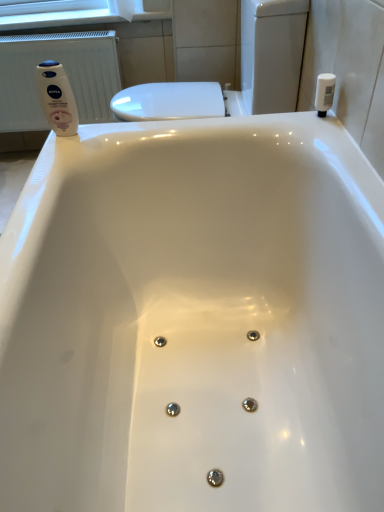
This screenshot has width=384, height=512. What do you see at coordinates (324, 93) in the screenshot? I see `white plastic bottle at upper right, which appears as the 2th toiletry when viewed from the left` at bounding box center [324, 93].

Identify the location of white matte toilet paper at upper left. The image size is (384, 512). (126, 8).

Identify the location of toiletry that is the 1st one when counting downward from the white matte toilet paper at upper left (from the image's perspective). (324, 93).

Between point (122, 14) and point (332, 86), which one is positioned behind?

Positioned behind is point (122, 14).

Considering the relative sizes of white matte toilet paper at upper left and white plastic bottle at upper right, marked as the first toiletry in a right-to-left arrangement, in the image provided, is white matte toilet paper at upper left bigger than white plastic bottle at upper right, marked as the first toiletry in a right-to-left arrangement,?

Indeed, white matte toilet paper at upper left has a larger size compared to white plastic bottle at upper right, marked as the first toiletry in a right-to-left arrangement.

Identify the location of toilet paper above the white plastic radiator at left (from the image's perspective). (126, 8).

Would you say white plastic radiator at left is to the left or to the right of white matte toilet paper at upper left in the picture?

From the image, it's evident that white plastic radiator at left is to the left of white matte toilet paper at upper left.

Looking at this image, from the image's perspective, is white plastic radiator at left located beneath white matte toilet paper at upper left?

Yes.

You are a GUI agent. You are given a task and a screenshot of the screen. Output one action in this format:
    pyautogui.click(x=<x>, y=<y>)
    Task: Click on the toilet paper that appears above the white plastic bottle at upper right, marked as the first toiletry in a right-to-left arrangement (from a real-world perspective)
    This screenshot has width=384, height=512.
    Given the screenshot: What is the action you would take?
    pyautogui.click(x=126, y=8)

How many degrees apart are the facing directions of white plastic bottle at upper right, which appears as the 2th toiletry when viewed from the left, and white matte toilet paper at upper left?

90 degrees.

From a real-world perspective, who is located higher, white plastic bottle at upper right, marked as the first toiletry in a right-to-left arrangement, or white matte toilet paper at upper left?

In real-world perspective, white matte toilet paper at upper left is above.

Which of these two, white plastic bottle at upper right, marked as the first toiletry in a right-to-left arrangement, or white matte toilet paper at upper left, is wider?

white matte toilet paper at upper left is wider.

Is white matte toilet paper at upper left aimed at white matte lotion at upper left, which ranks as the 1th toiletry in left-to-right order?

Yes, white matte toilet paper at upper left faces towards white matte lotion at upper left, which ranks as the 1th toiletry in left-to-right order.

Which object is positioned more to the right, white matte toilet paper at upper left or white matte lotion at upper left, the second toiletry when ordered from right to left?

Positioned to the right is white matte toilet paper at upper left.

Can you confirm if white matte toilet paper at upper left is taller than white matte lotion at upper left, the second toiletry when ordered from right to left?

No, white matte toilet paper at upper left is not taller than white matte lotion at upper left, the second toiletry when ordered from right to left.

Can you confirm if white matte toilet paper at upper left is thinner than white matte lotion at upper left, the second toiletry when ordered from right to left?

No.

Considering their positions, is white matte toilet paper at upper left located in front of or behind white plastic radiator at left?

In the image, white matte toilet paper at upper left appears in front of white plastic radiator at left.

Locate an element on the screen. The width and height of the screenshot is (384, 512). toilet paper above the white plastic radiator at left (from the image's perspective) is located at coordinates (126, 8).

Which object is wider, white matte toilet paper at upper left or white plastic radiator at left?

white matte toilet paper at upper left is wider.

Which is closer to the camera, (136, 17) or (108, 63)?

Point (136, 17).

From the image's perspective, relative to white plastic bottle at upper right, marked as the first toiletry in a right-to-left arrangement, is white plastic radiator at left above or below?

Clearly, from the image's perspective, white plastic radiator at left is above white plastic bottle at upper right, marked as the first toiletry in a right-to-left arrangement.

Based on their sizes in the image, would you say white plastic radiator at left is bigger or smaller than white plastic bottle at upper right, which appears as the 2th toiletry when viewed from the left?

Clearly, white plastic radiator at left is larger in size than white plastic bottle at upper right, which appears as the 2th toiletry when viewed from the left.

Could you tell me if white plastic radiator at left is turned towards white plastic bottle at upper right, which appears as the 2th toiletry when viewed from the left?

No, white plastic radiator at left is not oriented towards white plastic bottle at upper right, which appears as the 2th toiletry when viewed from the left.

Locate an element on the screen. The height and width of the screenshot is (512, 384). the 2nd toiletry below the white plastic radiator at left (from the image's perspective) is located at coordinates (57, 98).

Is white matte lotion at upper left, which ranks as the 1th toiletry in left-to-right order, smaller than white plastic radiator at left?

Correct, white matte lotion at upper left, which ranks as the 1th toiletry in left-to-right order, occupies less space than white plastic radiator at left.

Does white matte lotion at upper left, which ranks as the 1th toiletry in left-to-right order, have a lesser width compared to white plastic radiator at left?

Yes, white matte lotion at upper left, which ranks as the 1th toiletry in left-to-right order, is thinner than white plastic radiator at left.

Image resolution: width=384 pixels, height=512 pixels. I want to click on toiletry that is the 1st one when counting downward from the white matte toilet paper at upper left (from the image's perspective), so click(x=324, y=93).

Locate an element on the screen. toilet paper that is above the white plastic radiator at left (from the image's perspective) is located at coordinates (126, 8).

Based on their spatial positions, is white matte lotion at upper left, which ranks as the 1th toiletry in left-to-right order, or white matte toilet paper at upper left closer to white plastic radiator at left?

Based on the image, white matte toilet paper at upper left appears to be nearer to white plastic radiator at left.

From the picture: Considering their positions, is white plastic bottle at upper right, which appears as the 2th toiletry when viewed from the left, positioned further to white matte toilet paper at upper left than white matte lotion at upper left, which ranks as the 1th toiletry in left-to-right order?

white plastic bottle at upper right, which appears as the 2th toiletry when viewed from the left, lies further to white matte toilet paper at upper left than the other object.

Which object lies further to the anchor point white plastic bottle at upper right, which appears as the 2th toiletry when viewed from the left, white plastic radiator at left or white matte lotion at upper left, which ranks as the 1th toiletry in left-to-right order?

white plastic radiator at left is positioned further to the anchor white plastic bottle at upper right, which appears as the 2th toiletry when viewed from the left.

Estimate the real-world distances between objects in this image. Which object is closer to white plastic radiator at left, white matte toilet paper at upper left or white matte lotion at upper left, the second toiletry when ordered from right to left?

The object closer to white plastic radiator at left is white matte toilet paper at upper left.

Estimate the real-world distances between objects in this image. Which object is closer to white matte lotion at upper left, the second toiletry when ordered from right to left, white plastic bottle at upper right, marked as the first toiletry in a right-to-left arrangement, or white plastic radiator at left?

white plastic bottle at upper right, marked as the first toiletry in a right-to-left arrangement, lies closer to white matte lotion at upper left, the second toiletry when ordered from right to left, than the other object.

Which object lies further to the anchor point white matte toilet paper at upper left, white matte lotion at upper left, which ranks as the 1th toiletry in left-to-right order, or white plastic radiator at left?

The object further to white matte toilet paper at upper left is white matte lotion at upper left, which ranks as the 1th toiletry in left-to-right order.

Considering their positions, is white matte toilet paper at upper left positioned further to white matte lotion at upper left, which ranks as the 1th toiletry in left-to-right order, than white plastic bottle at upper right, marked as the first toiletry in a right-to-left arrangement?

white matte toilet paper at upper left is positioned further to the anchor white matte lotion at upper left, which ranks as the 1th toiletry in left-to-right order.

Looking at the image, which one is located closer to white plastic bottle at upper right, marked as the first toiletry in a right-to-left arrangement, white matte toilet paper at upper left or white plastic radiator at left?

white matte toilet paper at upper left is closer to white plastic bottle at upper right, marked as the first toiletry in a right-to-left arrangement.

Locate an element on the screen. Image resolution: width=384 pixels, height=512 pixels. toiletry situated between white plastic radiator at left and white plastic bottle at upper right, marked as the first toiletry in a right-to-left arrangement, from left to right is located at coordinates (57, 98).

Locate an element on the screen. toiletry positioned between white matte lotion at upper left, which ranks as the 1th toiletry in left-to-right order, and white matte toilet paper at upper left from near to far is located at coordinates (324, 93).

The image size is (384, 512). I want to click on toilet paper between white matte lotion at upper left, which ranks as the 1th toiletry in left-to-right order, and white plastic radiator at left in the front-back direction, so click(x=126, y=8).

This screenshot has width=384, height=512. I want to click on toilet paper between white plastic radiator at left and white plastic bottle at upper right, which appears as the 2th toiletry when viewed from the left, from left to right, so click(x=126, y=8).